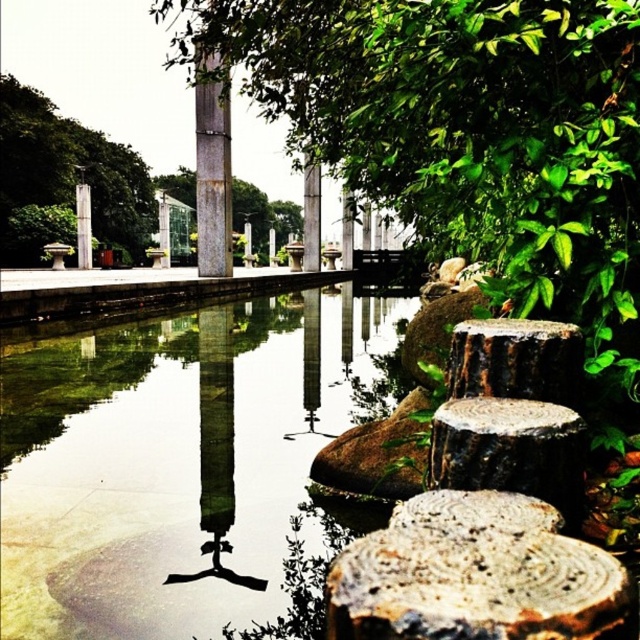
Between green leafy tree at upper left and rusty metal pole at center, which one appears on the right side from the viewer's perspective?

From the viewer's perspective, rusty metal pole at center appears more on the right side.

Is point (1, 188) behind point (202, 244)?

That is True.

Which is behind, point (19, 147) or point (211, 252)?

Positioned behind is point (19, 147).

I want to click on green leafy tree at upper left, so click(x=65, y=180).

Who is lower down, green leafy tree at upper left or rustic wooden post at center?

rustic wooden post at center is below.

Where is `green leafy tree at upper left`? green leafy tree at upper left is located at coordinates (65, 180).

Does point (0, 182) lie behind point (292, 218)?

No.

Where is `green leafy tree at upper left`? The height and width of the screenshot is (640, 640). green leafy tree at upper left is located at coordinates (65, 180).

Does point (285, 202) come in front of point (77, 243)?

No, it is not.

Between rustic wooden post at center and white marble pillar at center, which one is positioned lower?

white marble pillar at center is below.

This screenshot has height=640, width=640. Describe the element at coordinates (262, 216) in the screenshot. I see `rustic wooden post at center` at that location.

Image resolution: width=640 pixels, height=640 pixels. I want to click on rustic wooden post at center, so click(262, 216).